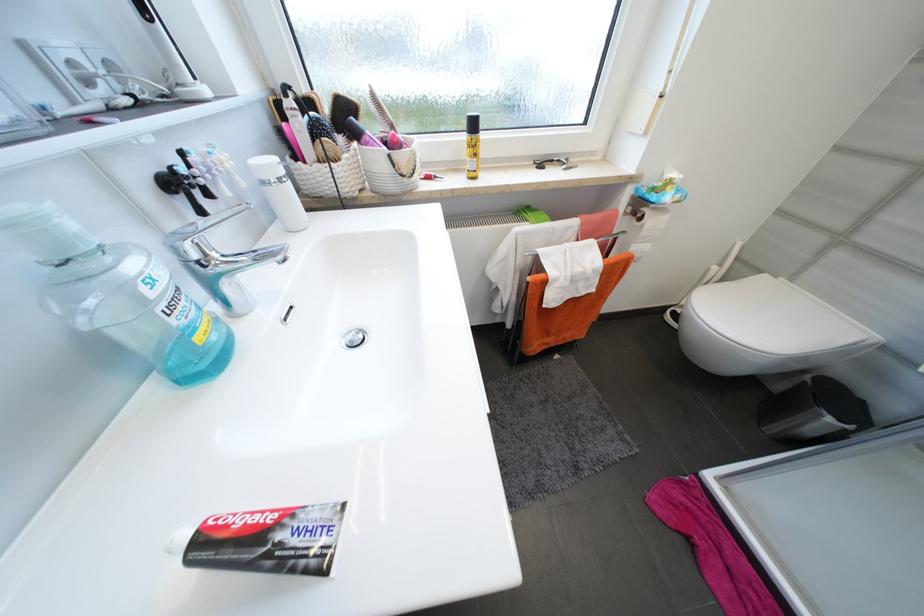
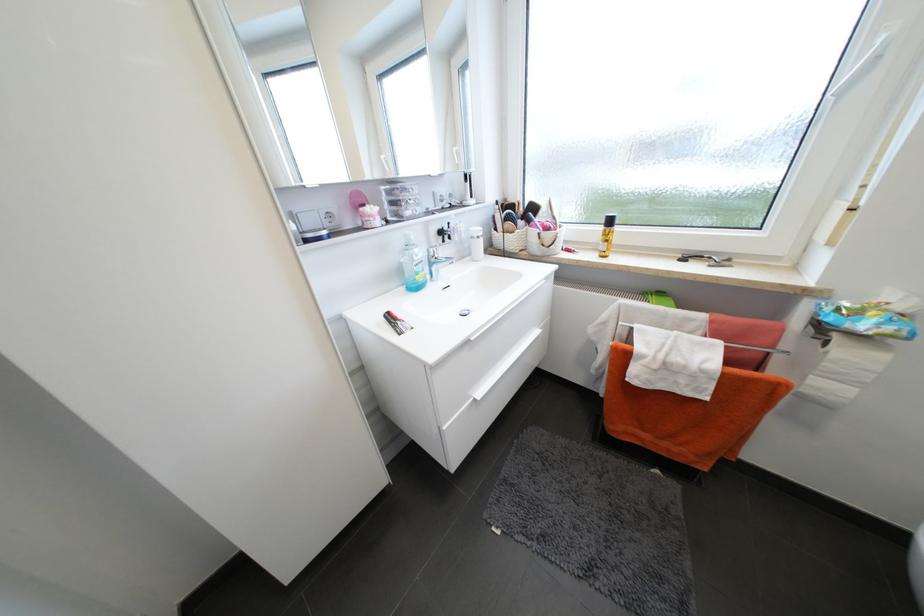
In the second image, find the point that corresponds to the point at 271,185 in the first image.

(478, 238)